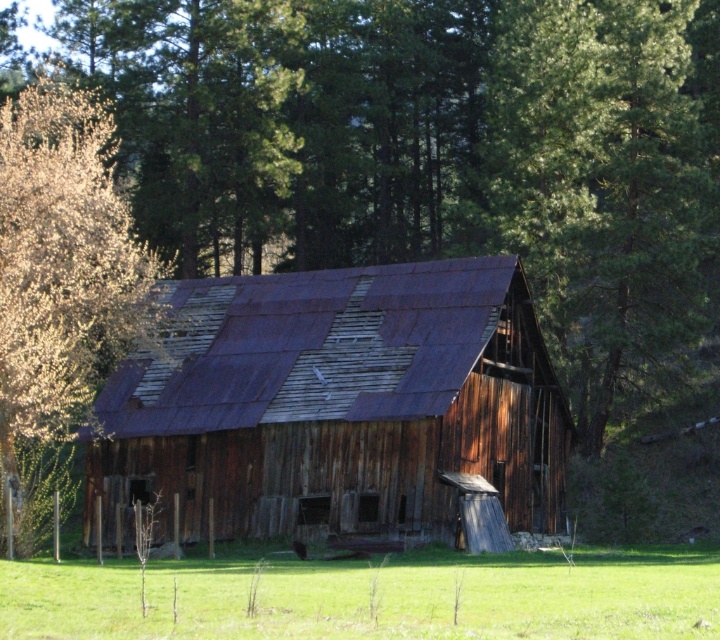
How far apart are green grass at lower center and golden textured leaves at left?

green grass at lower center is 13.22 meters away from golden textured leaves at left.

Between green grass at lower center and golden textured leaves at left, which one appears on the left side from the viewer's perspective?

golden textured leaves at left

I want to click on green grass at lower center, so click(x=372, y=596).

Which of these two, rusty wood barn at center or golden textured leaves at left, stands taller?

Standing taller between the two is golden textured leaves at left.

Does point (451, 442) come in front of point (4, 483)?

No, (451, 442) is behind (4, 483).

What are the coordinates of `rusty wood barn at center` in the screenshot? It's located at (338, 404).

Between rusty wood barn at center and green leafy tree at center, which one is positioned higher?

Positioned higher is green leafy tree at center.

Who is more forward, (253, 394) or (541, 256)?

Point (253, 394)

The height and width of the screenshot is (640, 720). I want to click on rusty wood barn at center, so click(338, 404).